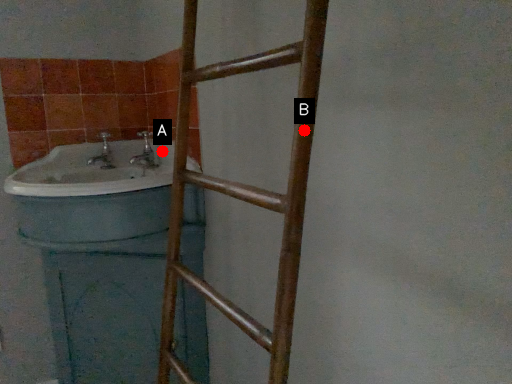
Question: Two points are circled on the image, labeled by A and B beside each circle. Which point is farther from the camera taking this photo?

Choices:
 (A) A is further
 (B) B is further

Answer: (A)